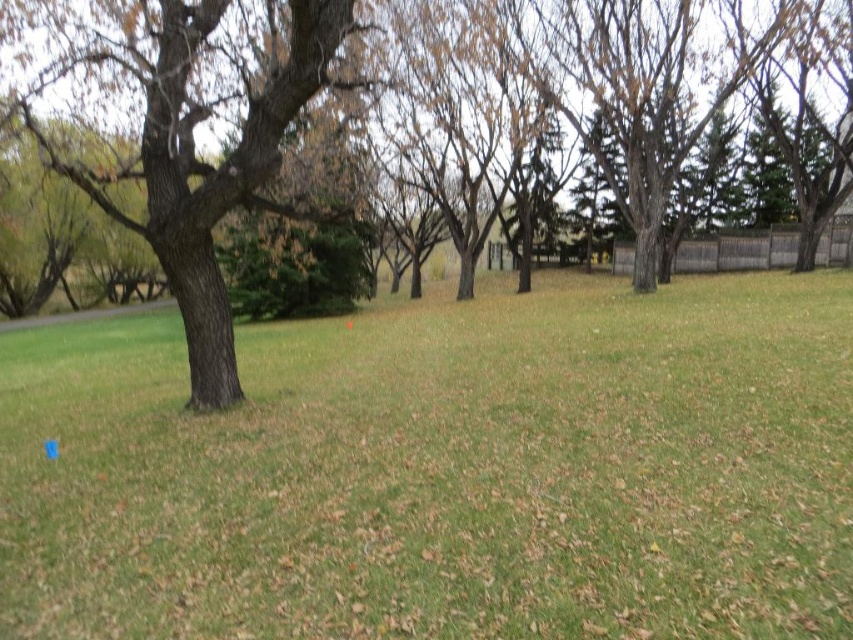
You are standing in the park and see the brown rough tree at left and the smooth brown tree at left. Which one is positioned more to the left side of the park?

The brown rough tree at left is positioned more to the left side of the park than the smooth brown tree at left.

Looking at this image, you are standing in the park and want to touch both the brown rough tree at left and the smooth brown tree at left. Which tree should you approach first to reach the closer one?

You should approach the brown rough tree at left first because it is closer to you than the smooth brown tree at left.